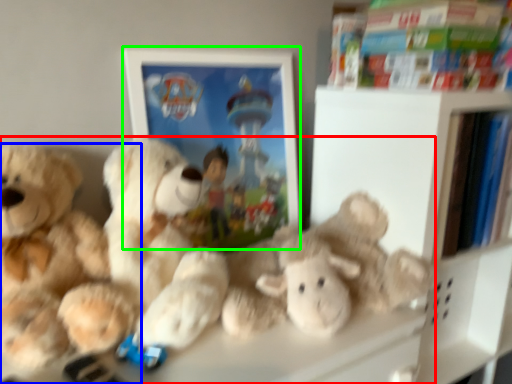
Question: Estimate the real-world distances between objects in this image. Which object is farther from teddy bear (highlighted by a red box), teddy bear (highlighted by a blue box) or picture frame (highlighted by a green box)?

Choices:
 (A) teddy bear
 (B) picture frame

Answer: (B)